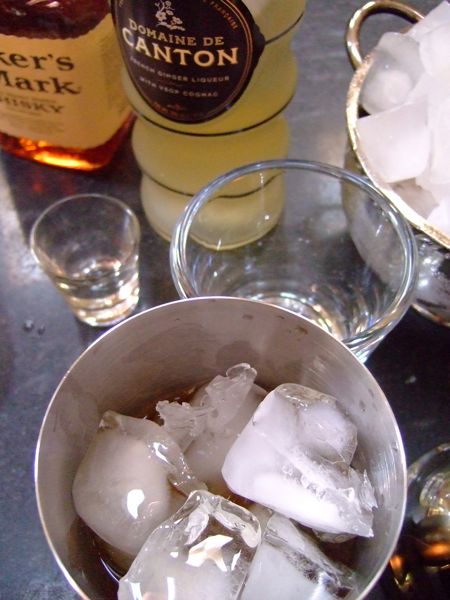
The image size is (450, 600). I want to click on cocktail shaker, so click(x=241, y=317), click(x=67, y=558), click(x=394, y=503).